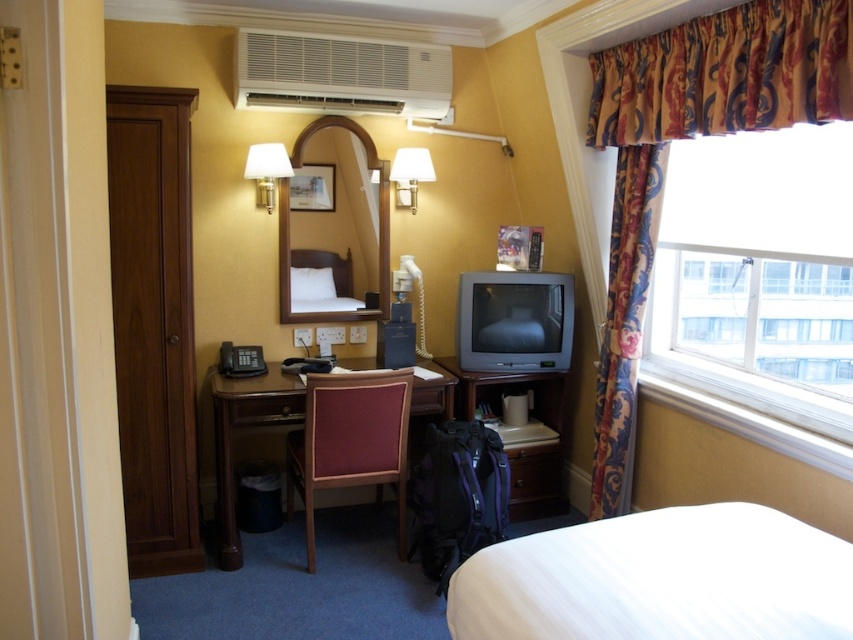
You are standing in the hotel room and want to move from the white matte wall lamp at upper left to the white soft bed at center. Which direction should you move in?

You should move forward towards the white soft bed at center because it is closer to you than the white matte wall lamp at upper left.

You are a guest in the hotel room and need to place a rectangular box that is 30 cm wide on the desk. The box must be placed between the maroon fabric chair at center and the white fabric lampshade at upper center. Can the box fit in that space?

The maroon fabric chair at center is wider than the white fabric lampshade at upper center. However, the question is about placing a box between them on the desk. Since the objects are not on the desk, their widths don